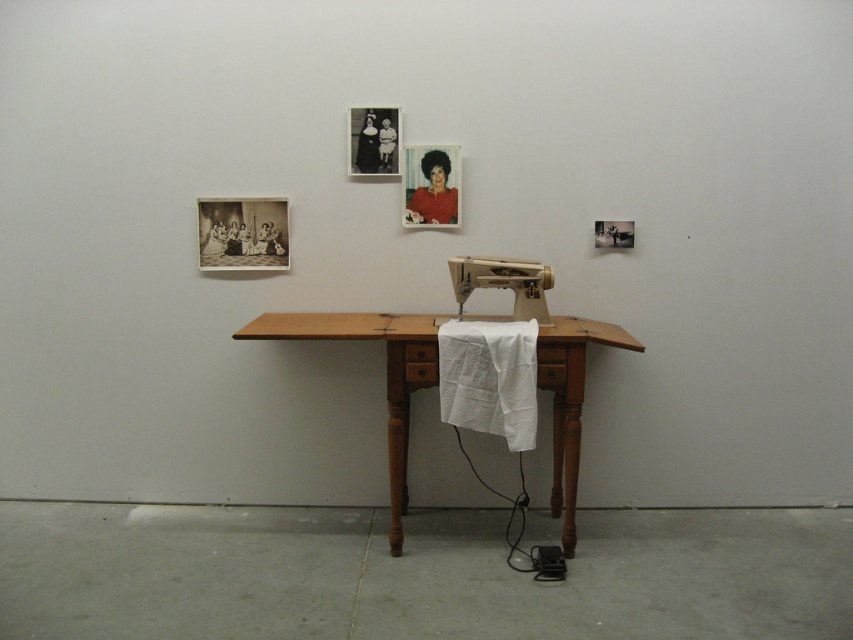
Does white plastic sewing machine at center have a larger size compared to black matte photo frame at upper center?

Correct, white plastic sewing machine at center is larger in size than black matte photo frame at upper center.

Does white plastic sewing machine at center have a greater width compared to black matte photo frame at upper center?

Indeed, white plastic sewing machine at center has a greater width compared to black matte photo frame at upper center.

Between point (477, 260) and point (380, 170), which one is positioned behind?

The point (380, 170) is behind.

You are a GUI agent. You are given a task and a screenshot of the screen. Output one action in this format:
    pyautogui.click(x=<x>, y=<y>)
    Task: Click on the white plastic sewing machine at center
    
    Given the screenshot: What is the action you would take?
    pyautogui.click(x=503, y=282)

Is point (482, 355) positioned behind point (379, 156)?

No, (482, 355) is in front of (379, 156).

You are a GUI agent. You are given a task and a screenshot of the screen. Output one action in this format:
    pyautogui.click(x=<x>, y=<y>)
    Task: Click on the white cotton cloth at center
    
    Given the screenshot: What is the action you would take?
    pyautogui.click(x=489, y=378)

Identify the location of white cotton cloth at center. (489, 378).

Is wooden sewing machine at center above black matte photo frame at upper center?

No, wooden sewing machine at center is not above black matte photo frame at upper center.

What do you see at coordinates (386, 374) in the screenshot? I see `wooden sewing machine at center` at bounding box center [386, 374].

I want to click on wooden sewing machine at center, so click(x=386, y=374).